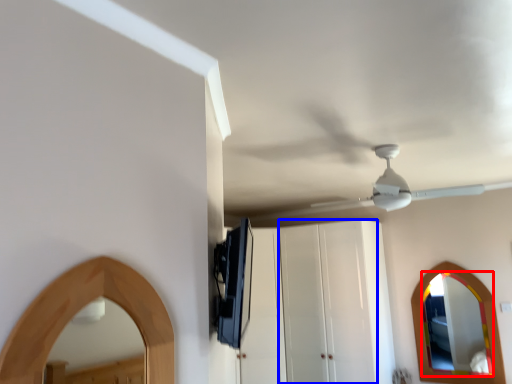
Question: Which object is closer to the camera taking this photo, mirror (highlighted by a red box) or glass door (highlighted by a blue box)?

Choices:
 (A) mirror
 (B) glass door

Answer: (A)